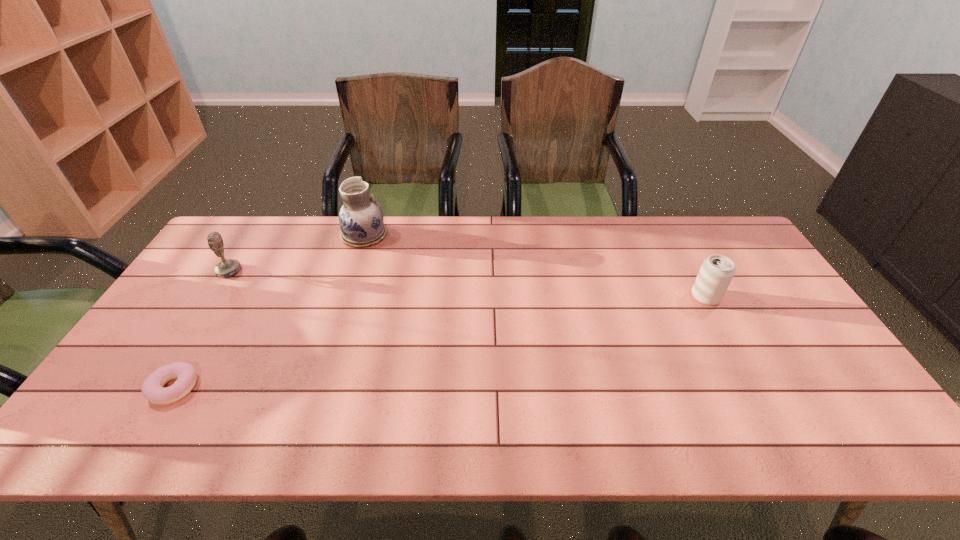
The image size is (960, 540). I want to click on the closest object to the farthest object, so click(226, 268).

Locate an element on the screen. Image resolution: width=960 pixels, height=540 pixels. object that ranks as the closest to the can is located at coordinates (361, 222).

This screenshot has width=960, height=540. I want to click on free region that satisfies the following two spatial constraints: 1. on the front-facing side of the second farthest object; 2. on the left side of the can, so click(x=212, y=297).

Locate an element on the screen. The height and width of the screenshot is (540, 960). free space that satisfies the following two spatial constraints: 1. on the front-facing side of the third nearest object; 2. on the right side of the second nearest object is located at coordinates (212, 297).

Locate an element on the screen. This screenshot has height=540, width=960. free location that satisfies the following two spatial constraints: 1. on the front-facing side of the second farthest object; 2. on the left side of the rightmost object is located at coordinates (212, 297).

Find the location of a particular element. free location that satisfies the following two spatial constraints: 1. on the front-facing side of the third nearest object; 2. on the left side of the doughnut is located at coordinates (155, 388).

Where is `vacant space that satisfies the following two spatial constraints: 1. on the front-facing side of the third farthest object; 2. on the right side of the third nearest object`? This screenshot has height=540, width=960. vacant space that satisfies the following two spatial constraints: 1. on the front-facing side of the third farthest object; 2. on the right side of the third nearest object is located at coordinates (212, 297).